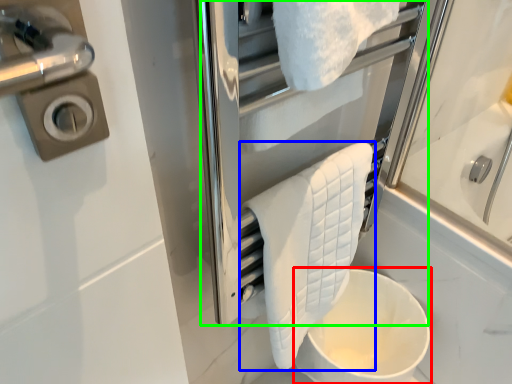
Question: Which is farther away from toilet bowl (highlighted by a red box)? towel (highlighted by a blue box) or screen door (highlighted by a green box)?

Choices:
 (A) towel
 (B) screen door

Answer: (B)